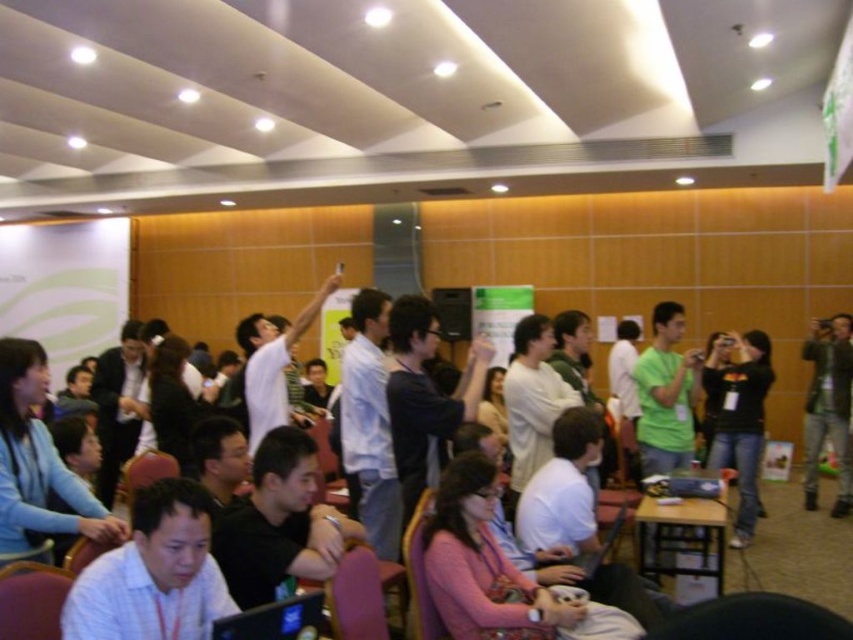
You are an event planner arranging a photo shoot in the conference room. You need to position two models wearing the black cotton shirt at center and the green leather jacket at right. To ensure both models are visible in the frame, which model should stand closer to the camera?

The black cotton shirt at center should stand closer to the camera because it is shorter than the green leather jacket at right, ensuring both are visible in the frame.

You are an event organizer and need to arrange a quick exit path for attendees. You notice the black cotton shirt at center and the green leather jacket at right. Which direction should you direct the crowd to move towards to avoid blocking these individuals?

The black cotton shirt at center is to the left of the green leather jacket at right. To avoid blocking them, direct the crowd to move towards the right side of the green leather jacket at right, away from the black cotton shirt at center.

You are organizing a photo shoot and need to ensure that the black cotton shirt at center and the green leather jacket at right are visible in the frame. Given that the camera has a zoom lens that can adjust focus, which clothing item might require closer attention to ensure clarity due to its size?

The black cotton shirt at center has a larger size compared to the green leather jacket at right, so it might require closer attention to ensure clarity due to its larger size.